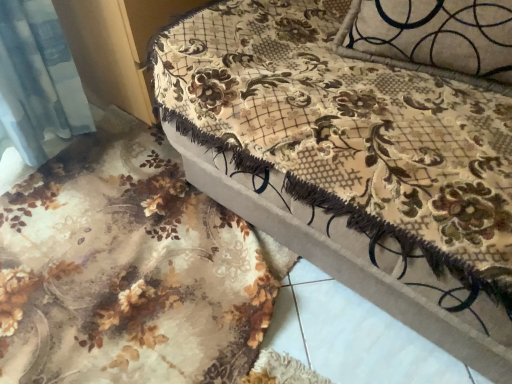
Question: Is velvet floral-patterned ottoman at center oriented away from velvet floral bed frame at upper right?

Choices:
 (A) yes
 (B) no

Answer: (B)

Question: Can you confirm if velvet floral-patterned ottoman at center is thinner than velvet floral bed frame at upper right?

Choices:
 (A) yes
 (B) no

Answer: (B)

Question: From a real-world perspective, is velvet floral-patterned ottoman at center located higher than velvet floral bed frame at upper right?

Choices:
 (A) yes
 (B) no

Answer: (A)

Question: From a real-world perspective, is velvet floral-patterned ottoman at center positioned under velvet floral bed frame at upper right based on gravity?

Choices:
 (A) no
 (B) yes

Answer: (A)

Question: Can you confirm if velvet floral-patterned ottoman at center is positioned to the left of velvet floral bed frame at upper right?

Choices:
 (A) yes
 (B) no

Answer: (B)

Question: Is velvet floral-patterned ottoman at center taller than velvet floral bed frame at upper right?

Choices:
 (A) no
 (B) yes

Answer: (B)

Question: Is velvet floral bed frame at upper right located outside velvet floral-patterned ottoman at center?

Choices:
 (A) no
 (B) yes

Answer: (B)

Question: From a real-world perspective, is velvet floral bed frame at upper right below velvet floral-patterned ottoman at center?

Choices:
 (A) yes
 (B) no

Answer: (A)

Question: Does velvet floral bed frame at upper right appear on the right side of velvet floral-patterned ottoman at center?

Choices:
 (A) yes
 (B) no

Answer: (B)

Question: Are velvet floral bed frame at upper right and velvet floral-patterned ottoman at center far apart?

Choices:
 (A) no
 (B) yes

Answer: (A)

Question: Can you confirm if velvet floral bed frame at upper right is taller than velvet floral-patterned ottoman at center?

Choices:
 (A) yes
 (B) no

Answer: (B)

Question: From a real-world perspective, is velvet floral bed frame at upper right positioned over velvet floral-patterned ottoman at center based on gravity?

Choices:
 (A) no
 (B) yes

Answer: (A)

Question: In terms of height, does velvet floral-patterned ottoman at center look taller or shorter compared to velvet floral bed frame at upper right?

Choices:
 (A) tall
 (B) short

Answer: (A)